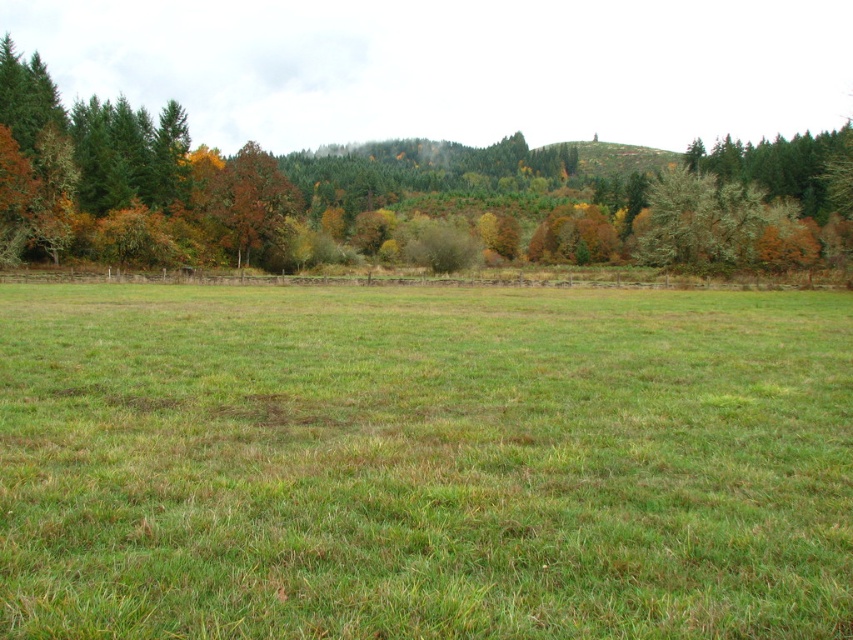
At what (x,y) coordinates should I click in order to perform the action: click on green leafy tree at center. Please return your answer as a coordinate pair (x, y). This screenshot has width=853, height=640. Looking at the image, I should click on (252, 163).

Does point (54, 109) come behind point (258, 227)?

That is True.

Where is `green leafy tree at center`? The image size is (853, 640). green leafy tree at center is located at coordinates (252, 163).

Does green grass pasture at center come behind green leafy tree at center?

No, green grass pasture at center is in front of green leafy tree at center.

Which of these two, green grass pasture at center or green leafy tree at center, stands taller?

green leafy tree at center is taller.

The height and width of the screenshot is (640, 853). What do you see at coordinates (422, 461) in the screenshot?
I see `green grass pasture at center` at bounding box center [422, 461].

This screenshot has height=640, width=853. I want to click on green grass pasture at center, so click(x=422, y=461).

Which is more to the left, green grass pasture at center or orange-brown bark tree at upper left?

From the viewer's perspective, orange-brown bark tree at upper left appears more on the left side.

Consider the image. Can you confirm if green grass pasture at center is bigger than orange-brown bark tree at upper left?

No.

Which is behind, point (10, 339) or point (210, 211)?

Positioned behind is point (210, 211).

You are a GUI agent. You are given a task and a screenshot of the screen. Output one action in this format:
    pyautogui.click(x=<x>, y=<y>)
    Task: Click on the green grass pasture at center
    The width and height of the screenshot is (853, 640).
    Given the screenshot: What is the action you would take?
    pyautogui.click(x=422, y=461)